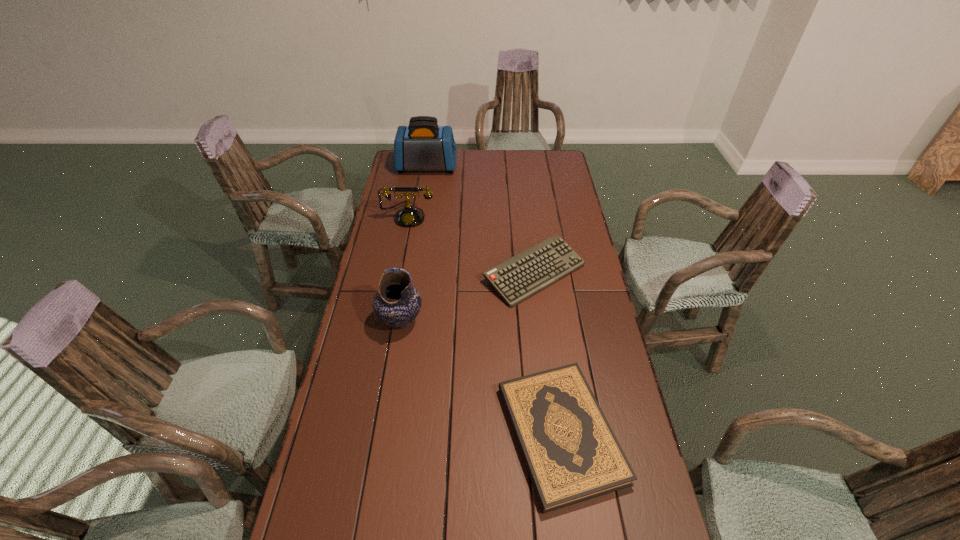
This screenshot has height=540, width=960. I want to click on vacant region between the fourth shortest object and the fourth nearest object, so click(404, 268).

At what (x,y) coordinates should I click in order to perform the action: click on free space between the pottery and the telephone. Please return your answer as a coordinate pair (x, y). Looking at the image, I should click on (404, 268).

At what (x,y) coordinates should I click in order to perform the action: click on empty location between the fourth tallest object and the fourth shortest object. Please return your answer as a coordinate pair (x, y). This screenshot has width=960, height=540. Looking at the image, I should click on (468, 297).

The width and height of the screenshot is (960, 540). Identify the location of object that can be found as the third closest to the nearest object. (409, 216).

Where is `object that stands as the second closest to the second tallest object`? Image resolution: width=960 pixels, height=540 pixels. object that stands as the second closest to the second tallest object is located at coordinates (572, 455).

Locate an element on the screen. vacant space that satisfies the following two spatial constraints: 1. on the front-facing side of the toaster; 2. on the dial of the third shortest object is located at coordinates (419, 216).

The height and width of the screenshot is (540, 960). What are the coordinates of `free space that satisfies the following two spatial constraints: 1. on the front-facing side of the computer keyboard; 2. on the left side of the tallest object` in the screenshot? It's located at (410, 273).

Where is `vacant area in the image that satisfies the following two spatial constraints: 1. on the back side of the computer keyboard; 2. on the left side of the second tallest object`? This screenshot has height=540, width=960. vacant area in the image that satisfies the following two spatial constraints: 1. on the back side of the computer keyboard; 2. on the left side of the second tallest object is located at coordinates (408, 273).

This screenshot has width=960, height=540. Find the location of `vacant position in the image that satisfies the following two spatial constraints: 1. on the front-facing side of the tallest object; 2. on the dial of the second farthest object`. vacant position in the image that satisfies the following two spatial constraints: 1. on the front-facing side of the tallest object; 2. on the dial of the second farthest object is located at coordinates (419, 216).

In order to click on free space that satisfies the following two spatial constraints: 1. on the dial of the nearest object; 2. on the left side of the third shortest object in this screenshot , I will do `click(368, 434)`.